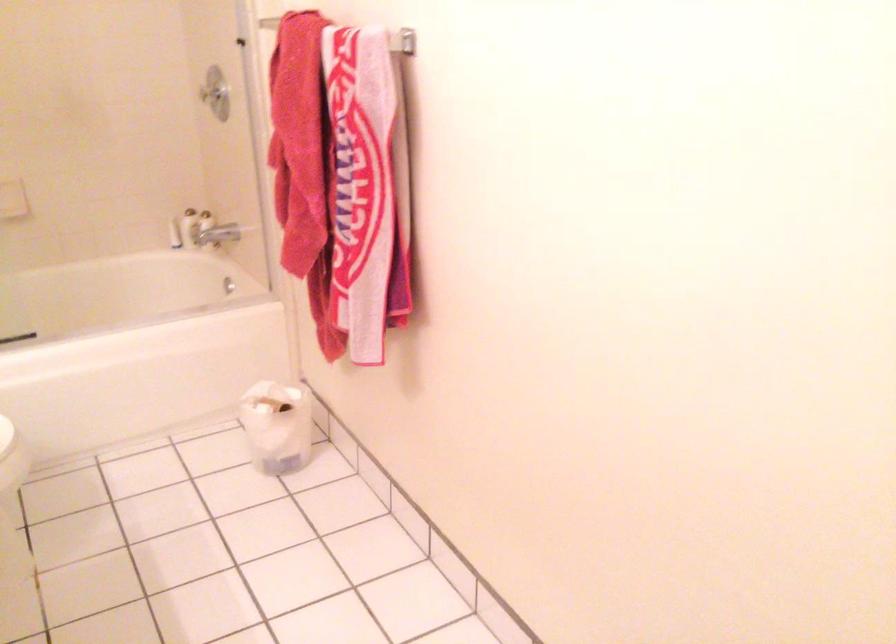
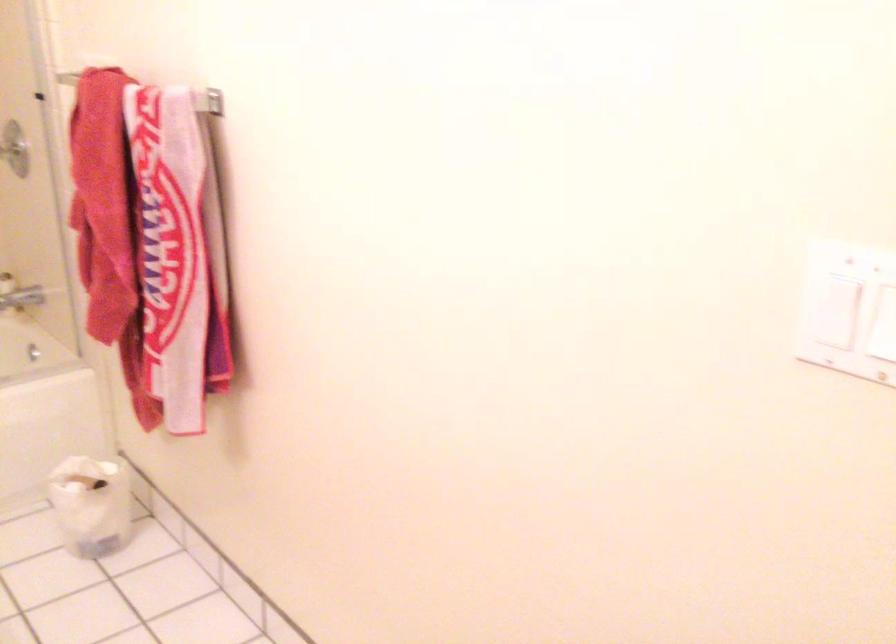
Question: What movement of the cameraman would produce the second image?

Choices:
 (A) Left
 (B) Right
 (C) Forward
 (D) Backward

Answer: (B)